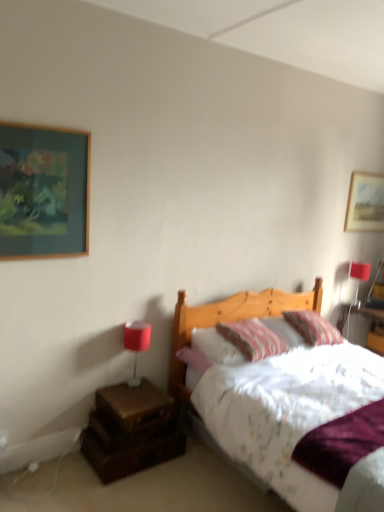
Question: Does brown wooden nightstand at lower left appear on the right side of wooden picture frame at upper right, which is the first picture frame in back-to-front order?

Choices:
 (A) yes
 (B) no

Answer: (B)

Question: From the image's perspective, is brown wooden nightstand at lower left on wooden picture frame at upper right, which ranks as the 2th picture frame in left-to-right order?

Choices:
 (A) yes
 (B) no

Answer: (B)

Question: Could you tell me if brown wooden nightstand at lower left is turned towards wooden picture frame at upper right, which is counted as the 1th picture frame, starting from the right?

Choices:
 (A) no
 (B) yes

Answer: (A)

Question: Is brown wooden nightstand at lower left thinner than wooden picture frame at upper right, which is the first picture frame in back-to-front order?

Choices:
 (A) no
 (B) yes

Answer: (A)

Question: Does brown wooden nightstand at lower left have a greater width compared to wooden picture frame at upper right, which is counted as the 1th picture frame, starting from the right?

Choices:
 (A) no
 (B) yes

Answer: (B)

Question: From the image's perspective, relative to matte red lampshade at upper right, the 2th table lamp viewed from the left, is striped fabric pillow at upper right, the second pillow positioned from the left, above or below?

Choices:
 (A) below
 (B) above

Answer: (A)

Question: Does point pos(322,337) appear closer or farther from the camera than point pos(367,263)?

Choices:
 (A) closer
 (B) farther

Answer: (A)

Question: In terms of size, does striped fabric pillow at upper right, the second pillow positioned from the left, appear bigger or smaller than matte red lampshade at upper right, which is the 1th table lamp in top-to-bottom order?

Choices:
 (A) small
 (B) big

Answer: (B)

Question: Considering their positions, is striped fabric pillow at upper right, the second pillow positioned from the left, located in front of or behind matte red lampshade at upper right, the 1th table lamp in the back-to-front sequence?

Choices:
 (A) front
 (B) behind

Answer: (A)

Question: From a real-world perspective, is brown wooden nightstand at lower left positioned above or below matte red lampshade at upper right, placed as the 1th table lamp when sorted from right to left?

Choices:
 (A) below
 (B) above

Answer: (A)

Question: In terms of height, does brown wooden nightstand at lower left look taller or shorter compared to matte red lampshade at upper right, which is the 1th table lamp in top-to-bottom order?

Choices:
 (A) short
 (B) tall

Answer: (A)

Question: From the image's perspective, is brown wooden nightstand at lower left located above or below matte red lampshade at upper right, placed as the 1th table lamp when sorted from right to left?

Choices:
 (A) above
 (B) below

Answer: (B)

Question: Looking at the image, does brown wooden nightstand at lower left seem bigger or smaller compared to matte red lampshade at upper right, the 1th table lamp in the back-to-front sequence?

Choices:
 (A) small
 (B) big

Answer: (B)

Question: Looking at their shapes, would you say brown wooden nightstand at lower left is wider or thinner than striped fabric pillow at center, which appears as the second pillow when viewed from the right?

Choices:
 (A) thin
 (B) wide

Answer: (A)

Question: Do you think brown wooden nightstand at lower left is within striped fabric pillow at center, which appears as the second pillow when viewed from the right, or outside of it?

Choices:
 (A) outside
 (B) inside

Answer: (A)